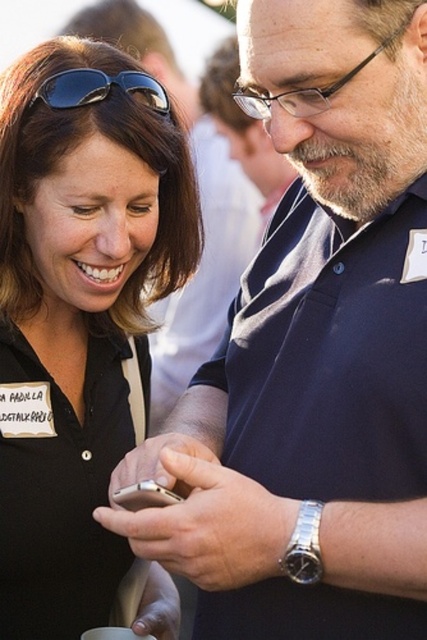
Question: Estimate the real-world distances between objects in this image. Which object is farther from the black matte sunglasses at upper left?

Choices:
 (A) matte black shirt at center
 (B) silver metallic smartphone at center

Answer: (B)

Question: Which of the following is the farthest from the observer?

Choices:
 (A) black matte sunglasses at upper left
 (B) matte black shirt at center

Answer: (A)

Question: Is matte black shirt at center below black matte sunglasses at upper left?

Choices:
 (A) no
 (B) yes

Answer: (B)

Question: Which object appears farthest from the camera in this image?

Choices:
 (A) matte black shirt at center
 (B) black matte sunglasses at upper left
 (C) silver metallic smartphone at center

Answer: (B)

Question: Is matte black shirt at center thinner than black matte sunglasses at upper left?

Choices:
 (A) yes
 (B) no

Answer: (B)

Question: Is black matte sunglasses at upper left below silver metallic smartphone at center?

Choices:
 (A) yes
 (B) no

Answer: (B)